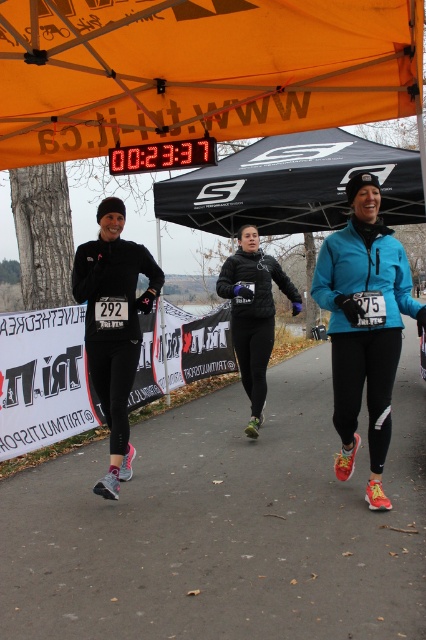
Does matte blue jacket at center have a larger size compared to matte black running shoe at center?

Correct, matte blue jacket at center is larger in size than matte black running shoe at center.

Which of these two, matte blue jacket at center or matte black running shoe at center, stands taller?

matte black running shoe at center

Where is `matte blue jacket at center`? The image size is (426, 640). matte blue jacket at center is located at coordinates (365, 324).

Find the location of a particular element. The height and width of the screenshot is (640, 426). matte blue jacket at center is located at coordinates (365, 324).

Between black matte running shoes at lower center and orange fabric canopy at upper center, which one is positioned lower?

Positioned lower is black matte running shoes at lower center.

Does black matte running shoes at lower center have a larger size compared to orange fabric canopy at upper center?

No, black matte running shoes at lower center is not bigger than orange fabric canopy at upper center.

At what (x,y) coordinates should I click in order to perform the action: click on black matte running shoes at lower center. Please return your answer as a coordinate pair (x, y). The image size is (426, 640). Looking at the image, I should click on (226, 524).

How distant is black fabric canopy at upper center from matte black running shoe at center?

black fabric canopy at upper center is 3.91 meters away from matte black running shoe at center.

Between black fabric canopy at upper center and matte black running shoe at center, which one appears on the left side from the viewer's perspective?

matte black running shoe at center is more to the left.

Image resolution: width=426 pixels, height=640 pixels. Identify the location of black fabric canopy at upper center. (291, 186).